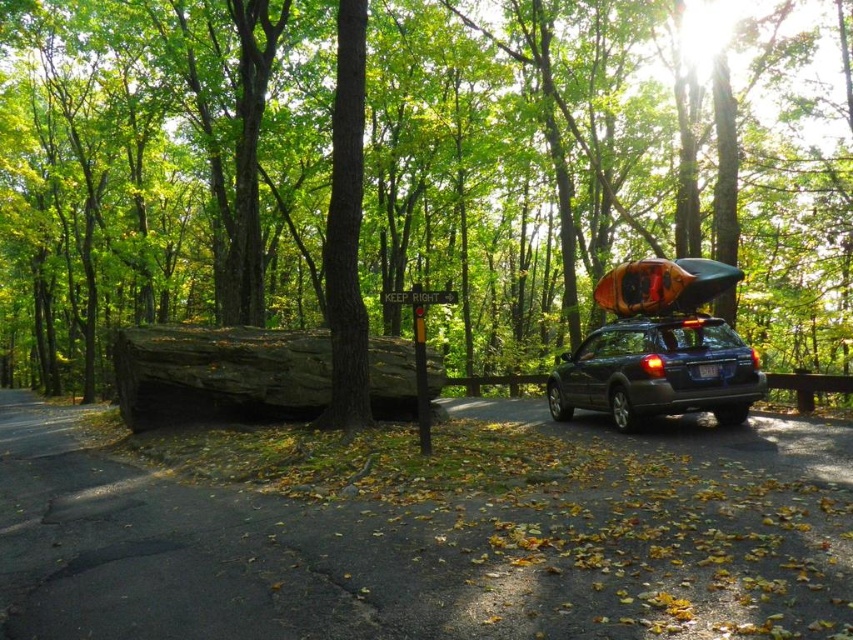
Question: Does dark gray rock at center have a smaller size compared to matte dark blue suv at center-right?

Choices:
 (A) no
 (B) yes

Answer: (B)

Question: Estimate the real-world distances between objects in this image. Which object is farther from the green leafy tree at center?

Choices:
 (A) dark gray rock at center
 (B) matte dark blue suv at center-right

Answer: (A)

Question: Which object is the closest to the dark gray rock at center?

Choices:
 (A) green leafy tree at center
 (B) matte dark blue suv at center-right

Answer: (B)

Question: Does green leafy tree at center appear under dark gray rock at center?

Choices:
 (A) yes
 (B) no

Answer: (B)

Question: Is green leafy tree at center positioned in front of matte dark blue suv at center-right?

Choices:
 (A) no
 (B) yes

Answer: (B)

Question: Which point appears closest to the camera in this image?

Choices:
 (A) [712, 369]
 (B) [247, 128]

Answer: (A)